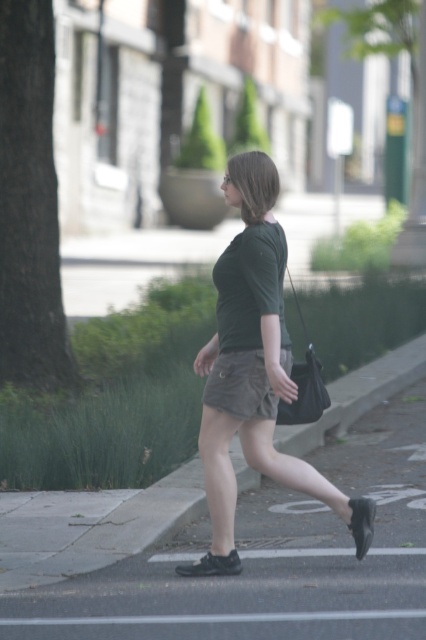
You are standing on the sidewalk and want to step onto the gray asphalt at lower center. Is the green matte skirt at center in your way?

The gray asphalt at lower center is closer to the viewer than the green matte skirt at center, so the green matte skirt at center is behind the gray asphalt at lower center and not in your way.

You are a delivery person who needs to place a small package on the gray asphalt at lower center. However, there is a green matte skirt at center nearby. Which object is shorter so that the package can be safely placed there?

The gray asphalt at lower center is not as tall as the green matte skirt at center, so the package can be safely placed on the gray asphalt at lower center since it is shorter.

You are a fashion designer observing the scene. You notice the green matte skirt at center and the black fabric bag at lower center. Which item is higher positioned on the person?

Answer: The green matte skirt at center is taller than the black fabric bag at lower center, so the skirt is positioned higher on the person.